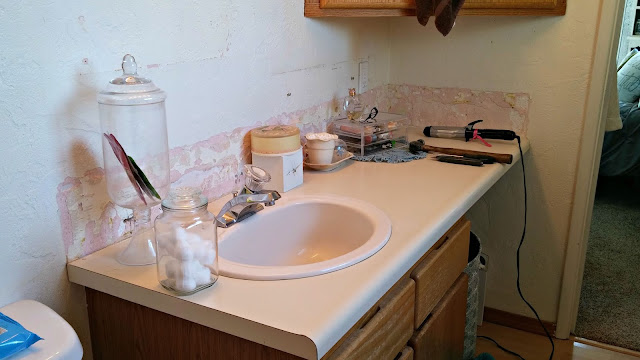
Where is `trash bin`? trash bin is located at coordinates (58, 347).